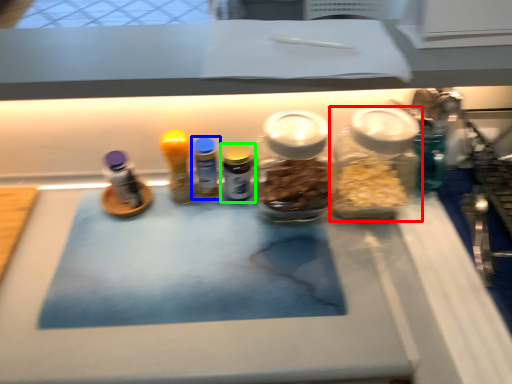
Question: Which object is positioned farthest from bottle (highlighted by a red box)? Select from bottle (highlighted by a blue box) and bottle (highlighted by a green box).

Choices:
 (A) bottle
 (B) bottle

Answer: (A)